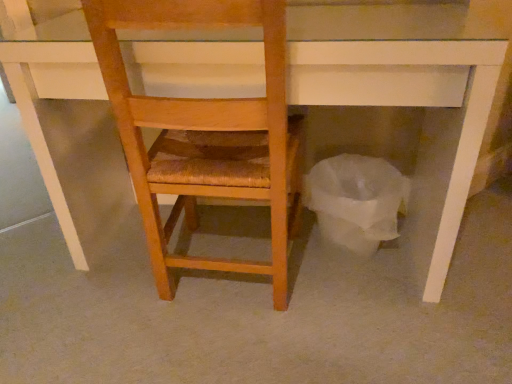
Question: Is wooden chair at center at the left side of white paper bag at lower right?

Choices:
 (A) yes
 (B) no

Answer: (A)

Question: Would you say wooden chair at center is a long distance from white paper bag at lower right?

Choices:
 (A) no
 (B) yes

Answer: (A)

Question: Is wooden chair at center completely or partially outside of white paper bag at lower right?

Choices:
 (A) yes
 (B) no

Answer: (A)

Question: Is wooden chair at center positioned with its back to white paper bag at lower right?

Choices:
 (A) yes
 (B) no

Answer: (B)

Question: Considering the relative positions of wooden chair at center and white paper bag at lower right in the image provided, is wooden chair at center in front of white paper bag at lower right?

Choices:
 (A) yes
 (B) no

Answer: (A)

Question: From a real-world perspective, is wooden chair at center over white paper bag at lower right?

Choices:
 (A) yes
 (B) no

Answer: (A)

Question: Is white paper bag at lower right to the right of wooden chair at center from the viewer's perspective?

Choices:
 (A) no
 (B) yes

Answer: (B)

Question: From a real-world perspective, is white paper bag at lower right on wooden chair at center?

Choices:
 (A) yes
 (B) no

Answer: (B)

Question: Is white paper bag at lower right bigger than wooden chair at center?

Choices:
 (A) no
 (B) yes

Answer: (A)

Question: Can wooden chair at center be found inside white paper bag at lower right?

Choices:
 (A) no
 (B) yes

Answer: (A)

Question: Is white paper bag at lower right outside wooden chair at center?

Choices:
 (A) no
 (B) yes

Answer: (B)

Question: From the image's perspective, is white paper bag at lower right under wooden chair at center?

Choices:
 (A) no
 (B) yes

Answer: (B)

Question: From a real-world perspective, relative to wooden chair at center, is white paper bag at lower right vertically above or below?

Choices:
 (A) above
 (B) below

Answer: (B)